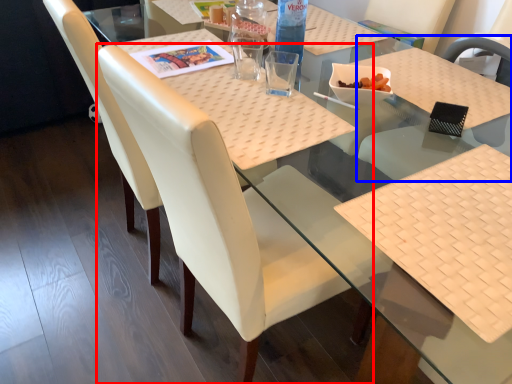
Question: Among these objects, which one is farthest to the camera, chair (highlighted by a red box) or chair (highlighted by a blue box)?

Choices:
 (A) chair
 (B) chair

Answer: (B)